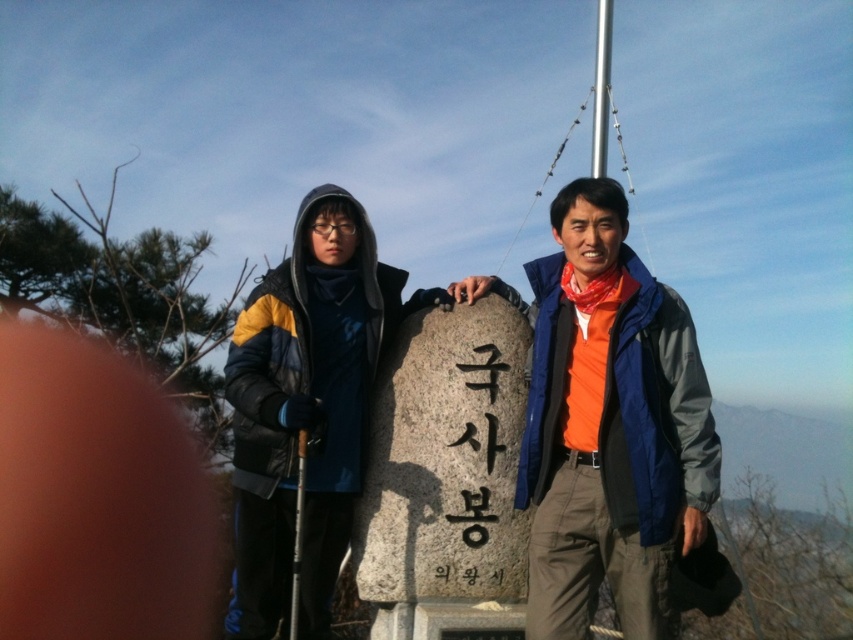
Question: Which object appears closest to the camera in this image?

Choices:
 (A) metallic pole at upper center
 (B) matte black ski pole at center
 (C) orange fabric scarf at center

Answer: (B)

Question: Is orange fabric scarf at center thinner than metallic pole at upper center?

Choices:
 (A) no
 (B) yes

Answer: (B)

Question: Which point is farther to the camera?

Choices:
 (A) (405, 516)
 (B) (664, 484)

Answer: (B)

Question: Is orange fabric scarf at center to the right of matte black ski pole at center from the viewer's perspective?

Choices:
 (A) no
 (B) yes

Answer: (B)

Question: Which object is closer to the camera taking this photo?

Choices:
 (A) gray stone at center
 (B) orange fabric scarf at center
 (C) black stone at center

Answer: (B)

Question: Considering the relative positions of orange fabric scarf at center and metallic pole at upper center in the image provided, where is orange fabric scarf at center located with respect to metallic pole at upper center?

Choices:
 (A) left
 (B) right

Answer: (A)